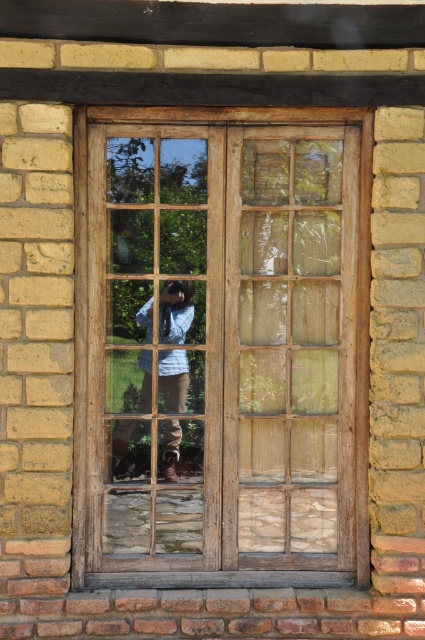
You are standing outside a building and notice the wooden window frame at center and the blue denim shirt at center in the reflection. Which object appears taller in the reflection?

The wooden window frame at center appears taller than the blue denim shirt at center in the reflection.

You are standing outside the building and want to take a photo of the wooden window frame at center without the blue denim shirt at center appearing in the reflection. Is this possible?

The wooden window frame at center is in front of the blue denim shirt at center, so the blue denim shirt at center would be obscured by the window frame in the reflection. Therefore, it is possible to take a photo of the wooden window frame at center without the blue denim shirt at center appearing in the reflection.